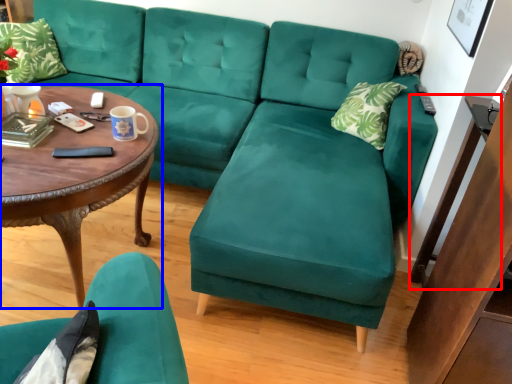
Question: Among these objects, which one is farthest to the camera, side table (highlighted by a red box) or coffee table (highlighted by a blue box)?

Choices:
 (A) side table
 (B) coffee table

Answer: (A)